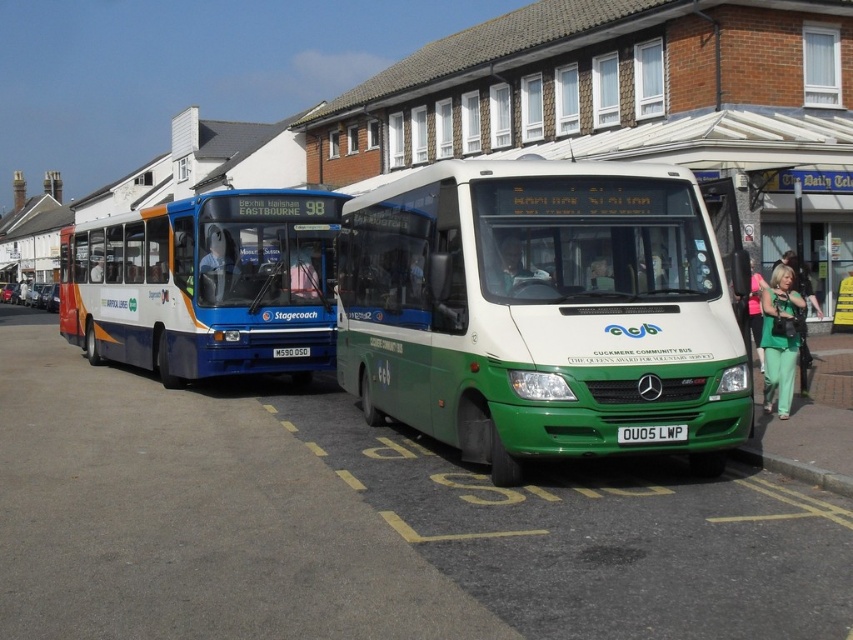
Question: Does green matte bus at center have a smaller size compared to black plastic license plate at center?

Choices:
 (A) yes
 (B) no

Answer: (B)

Question: Which of the following is the farthest from the observer?

Choices:
 (A) (660, 193)
 (B) (683, 422)

Answer: (A)

Question: Which point is farther to the camera?

Choices:
 (A) (276, 349)
 (B) (506, 371)
 (C) (666, 429)

Answer: (A)

Question: Which object is positioned closest to the blue metallic bus at center?

Choices:
 (A) green matte bus at center
 (B) black plastic license plate at center
 (C) white plastic license plate at center

Answer: (B)

Question: Is blue metallic bus at center smaller than black plastic license plate at center?

Choices:
 (A) no
 (B) yes

Answer: (A)

Question: Does green matte bus at center appear over blue metallic bus at center?

Choices:
 (A) yes
 (B) no

Answer: (B)